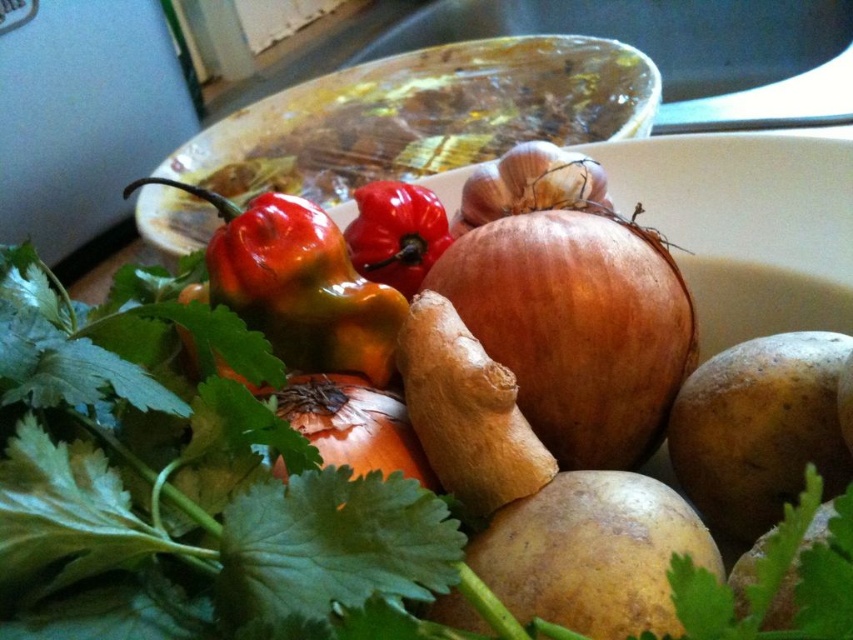
Is brown matte potato at center below brown matte potato at lower right?

Indeed, brown matte potato at center is positioned under brown matte potato at lower right.

Can you confirm if brown matte potato at center is bigger than brown matte potato at lower right?

No.

What do you see at coordinates (592, 554) in the screenshot? The width and height of the screenshot is (853, 640). I see `brown matte potato at center` at bounding box center [592, 554].

At what (x,y) coordinates should I click in order to perform the action: click on brown matte potato at center. Please return your answer as a coordinate pair (x, y). This screenshot has width=853, height=640. Looking at the image, I should click on (592, 554).

Is point (672, 337) less distant than point (628, 579)?

No, (672, 337) is behind (628, 579).

Which is above, brown matte onion at center or brown matte potato at center?

brown matte onion at center

What do you see at coordinates (570, 305) in the screenshot? The width and height of the screenshot is (853, 640). I see `brown matte onion at center` at bounding box center [570, 305].

Where is `brown matte onion at center`? The width and height of the screenshot is (853, 640). brown matte onion at center is located at coordinates (570, 305).

Based on the photo, is brown matte potato at lower right wider than matte brown garlic at center?

In fact, brown matte potato at lower right might be narrower than matte brown garlic at center.

Locate an element on the screen. Image resolution: width=853 pixels, height=640 pixels. brown matte potato at lower right is located at coordinates (759, 429).

Identify the location of brown matte potato at lower right. (759, 429).